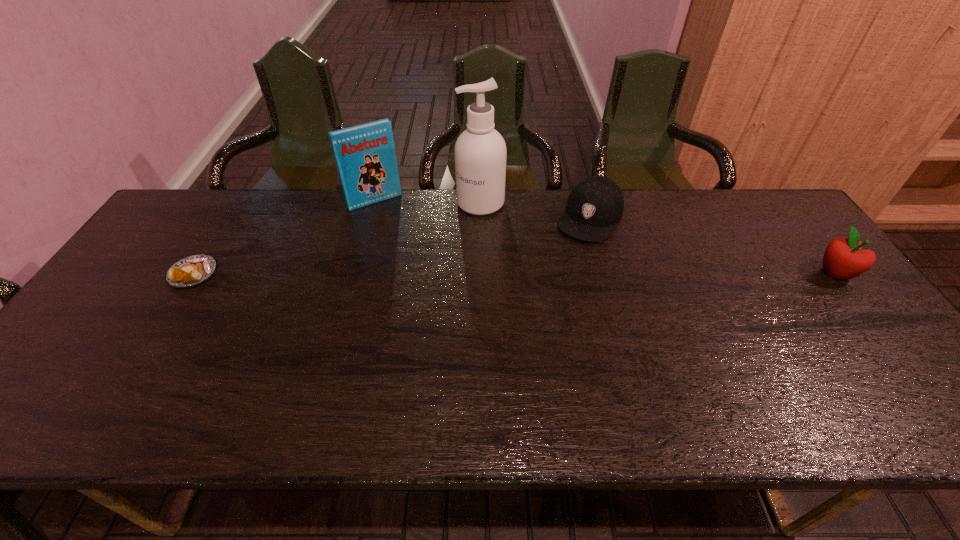
You are a GUI agent. You are given a task and a screenshot of the screen. Output one action in this format:
    pyautogui.click(x=<x>, y=<y>)
    Task: Click on the vacant space on the desktop that is between the leftmost object and the apple and is positioned on the front label of the tallest object
    The height and width of the screenshot is (540, 960).
    Given the screenshot: What is the action you would take?
    pyautogui.click(x=420, y=274)

Identify the location of vacant space on the desktop that is between the pastry and the rightmost object and is positioned on the front-facing side of the cap. (553, 274).

I want to click on free space on the desktop that is between the shortest object and the apple and is positioned on the front cover of the book, so click(423, 274).